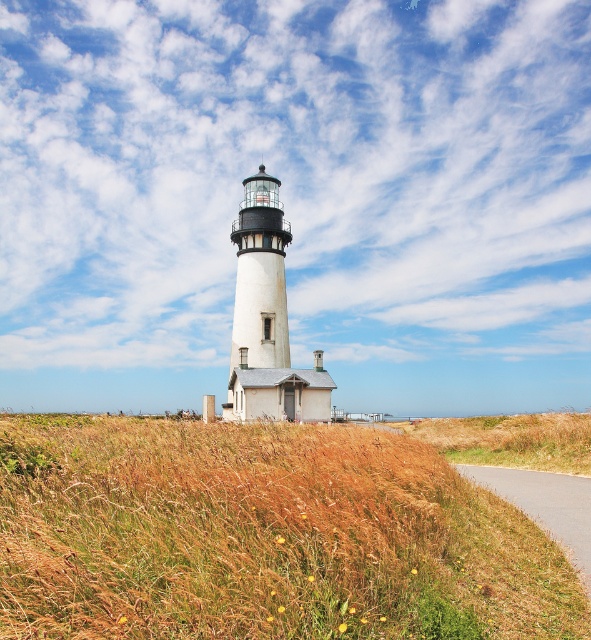
Is brown dry grass at lower center shorter than asphalt road at lower right?

Incorrect, brown dry grass at lower center's height does not fall short of asphalt road at lower right's.

Does brown dry grass at lower center have a greater width compared to asphalt road at lower right?

Indeed, brown dry grass at lower center has a greater width compared to asphalt road at lower right.

Image resolution: width=591 pixels, height=640 pixels. Find the location of `brown dry grass at lower center`. brown dry grass at lower center is located at coordinates pos(222,531).

Locate an element on the screen. The image size is (591, 640). brown dry grass at lower center is located at coordinates (222, 531).